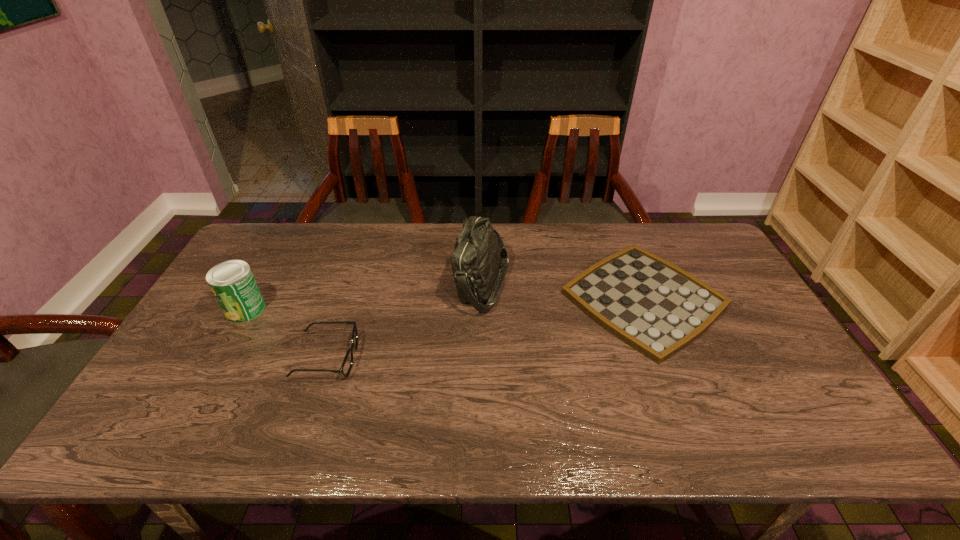
Locate an element on the screen. The width and height of the screenshot is (960, 540). free space located at the front padded panel of the second object from right to left is located at coordinates pos(373,284).

The width and height of the screenshot is (960, 540). Find the location of `vacant region located on the back of the leftmost object`. vacant region located on the back of the leftmost object is located at coordinates (285, 237).

The image size is (960, 540). I want to click on vacant space located on the front-facing side of the second shortest object, so click(507, 357).

The height and width of the screenshot is (540, 960). Identify the location of vacant space located on the left of the rightmost object. (526, 299).

Find the location of a particular element. The height and width of the screenshot is (540, 960). shoulder bag present at the far edge is located at coordinates (479, 252).

Find the location of a particular element. The height and width of the screenshot is (540, 960). checkerboard situated at the far edge is located at coordinates (654, 306).

Where is `object at the left edge`? Image resolution: width=960 pixels, height=540 pixels. object at the left edge is located at coordinates [x=232, y=282].

You are a GUI agent. You are given a task and a screenshot of the screen. Output one action in this format:
    pyautogui.click(x=<x>, y=<y>)
    Task: Click on the object that is at the right edge
    
    Given the screenshot: What is the action you would take?
    pyautogui.click(x=654, y=306)

This screenshot has width=960, height=540. What are the coordinates of `object positioned at the far right corner` in the screenshot? It's located at click(x=654, y=306).

Locate an element on the screen. vacant space at the far edge of the desktop is located at coordinates (509, 254).